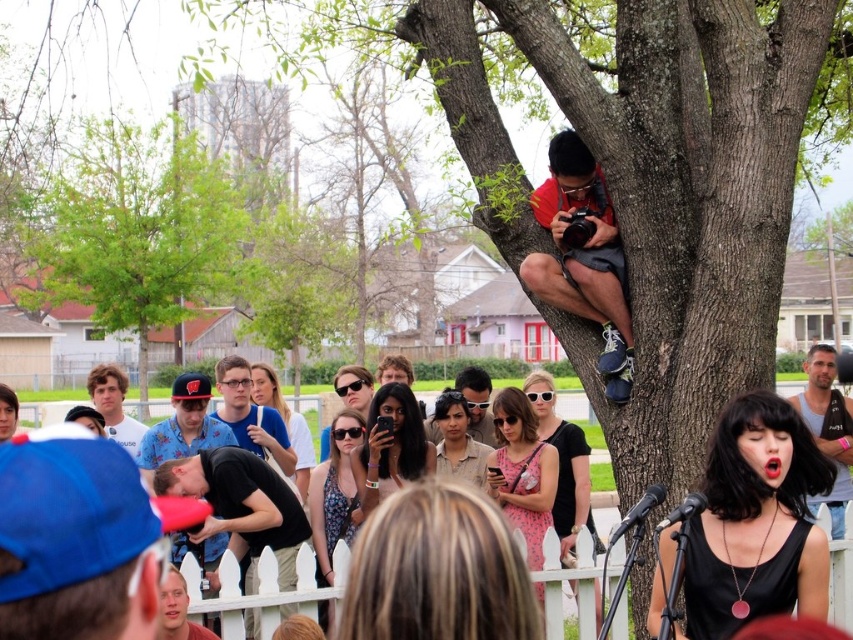
Question: Which object appears closest to the camera in this image?

Choices:
 (A) blue fabric cap at lower left
 (B) matte blue cap at center

Answer: (A)

Question: Does blue fabric cap at lower left have a greater width compared to white picket fence at lower center?

Choices:
 (A) yes
 (B) no

Answer: (B)

Question: Where is green leafy tree at upper left located in relation to matte black sunglasses at center in the image?

Choices:
 (A) right
 (B) left

Answer: (B)

Question: Is green leafy tree at upper left thinner than matte blue cap at center?

Choices:
 (A) yes
 (B) no

Answer: (B)

Question: Which point is closer to the camera?

Choices:
 (A) (547, 618)
 (B) (167, 308)
 (C) (489, 392)
 (D) (97, 451)

Answer: (D)

Question: Considering the real-world distances, which object is farthest from the light blue shirt at center?

Choices:
 (A) black matte shirt at lower left
 (B) gray tank top at right
 (C) white picket fence at lower center

Answer: (B)